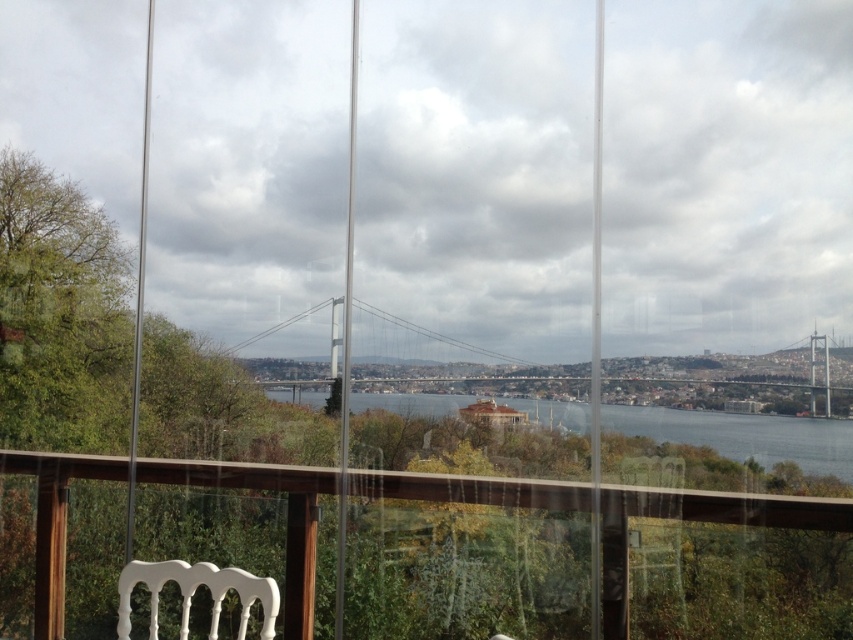
Measure the distance between transparent glass railing at center and blue water at center.

A distance of 13.03 inches exists between transparent glass railing at center and blue water at center.

Is point (677, 499) closer to camera compared to point (527, 401)?

Yes, point (677, 499) is closer to viewer.

At what (x,y) coordinates should I click in order to perform the action: click on transparent glass railing at center. Please return your answer as a coordinate pair (x, y). The width and height of the screenshot is (853, 640). Looking at the image, I should click on (479, 502).

Does blue water at center have a greater width compared to white plastic chair at lower center?

Indeed, blue water at center has a greater width compared to white plastic chair at lower center.

Does blue water at center have a greater height compared to white plastic chair at lower center?

No.

Is point (457, 397) positioned before point (659, 548)?

No, it is behind (659, 548).

This screenshot has height=640, width=853. Identify the location of blue water at center. (743, 435).

Between transparent glass railing at center and white plastic chair at lower center, which one is positioned lower?

transparent glass railing at center

Locate an element on the screen. This screenshot has width=853, height=640. transparent glass railing at center is located at coordinates (479, 502).

Is point (817, 522) closer to camera compared to point (654, 568)?

Yes, it is.

Where is `transparent glass railing at center`? The height and width of the screenshot is (640, 853). transparent glass railing at center is located at coordinates (479, 502).